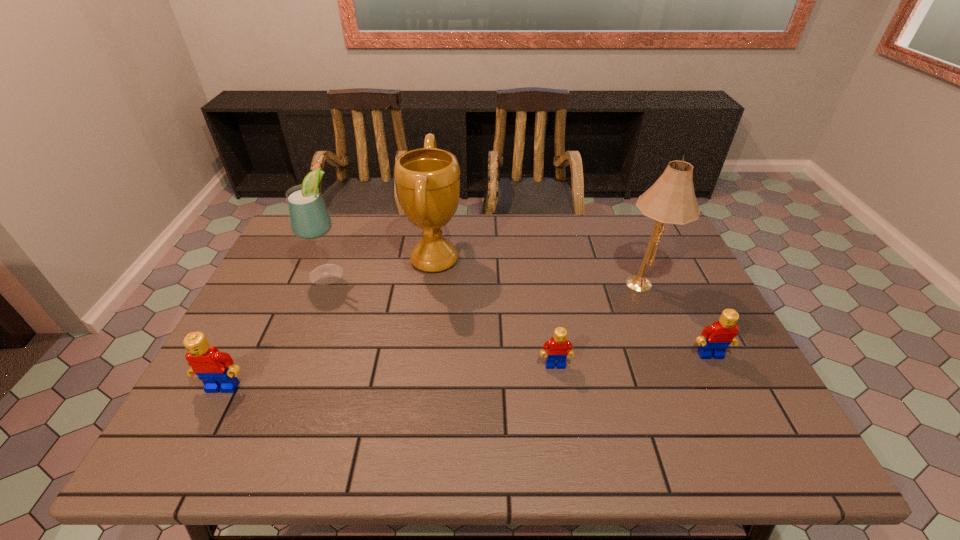
At what (x,y) coordinates should I click in order to perform the action: click on Lego object that ranks as the closest to the lampshade. Please return your answer as a coordinate pair (x, y). The width and height of the screenshot is (960, 540). Looking at the image, I should click on (720, 334).

This screenshot has height=540, width=960. Find the location of `vacant region that satisfies the following two spatial constraints: 1. on the front of the award with the decoration; 2. on the left side of the lampshade`. vacant region that satisfies the following two spatial constraints: 1. on the front of the award with the decoration; 2. on the left side of the lampshade is located at coordinates (431, 283).

Where is `vacant region that satisfies the following two spatial constraints: 1. on the front of the fourth object from right to left with the decoration; 2. on the back side of the lampshade`? vacant region that satisfies the following two spatial constraints: 1. on the front of the fourth object from right to left with the decoration; 2. on the back side of the lampshade is located at coordinates (431, 283).